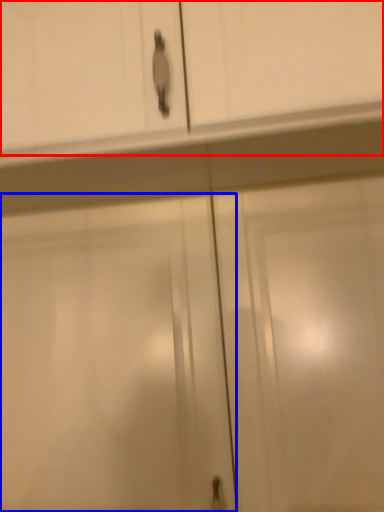
Question: Which point is further to the camera, cabinetry (highlighted by a red box) or screen door (highlighted by a blue box)?

Choices:
 (A) cabinetry
 (B) screen door

Answer: (B)